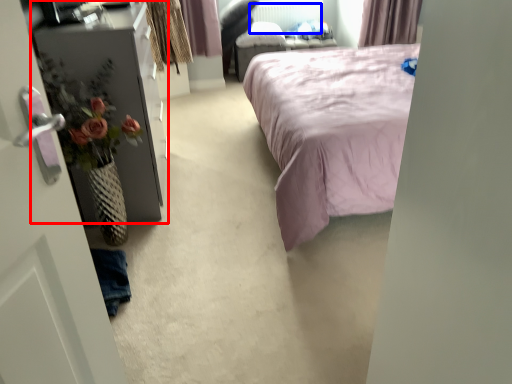
Question: Which point is further to the camera, furniture (highlighted by a red box) or radiator (highlighted by a blue box)?

Choices:
 (A) furniture
 (B) radiator

Answer: (B)